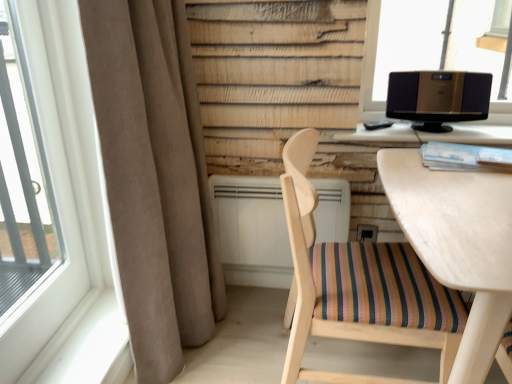
What are the coordinates of `free spot below metallic silver speaker at upper right (from a real-world perspective)` in the screenshot? It's located at (438, 130).